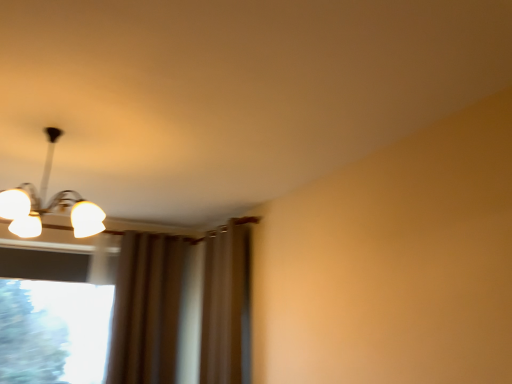
Question: From a real-world perspective, is transparent glass window at lower left physically above brown fabric curtain at center?

Choices:
 (A) no
 (B) yes

Answer: (A)

Question: Is transparent glass window at lower left oriented away from brown fabric curtain at center?

Choices:
 (A) yes
 (B) no

Answer: (B)

Question: Is the depth of transparent glass window at lower left greater than that of brown fabric curtain at center?

Choices:
 (A) no
 (B) yes

Answer: (B)

Question: Considering the relative sizes of transparent glass window at lower left and brown fabric curtain at center in the image provided, is transparent glass window at lower left taller than brown fabric curtain at center?

Choices:
 (A) no
 (B) yes

Answer: (A)

Question: Does transparent glass window at lower left have a lesser height compared to brown fabric curtain at center?

Choices:
 (A) no
 (B) yes

Answer: (B)

Question: Is transparent glass window at lower left wider or thinner than white glossy light fixture at upper left?

Choices:
 (A) thin
 (B) wide

Answer: (A)

Question: Considering the positions of transparent glass window at lower left and white glossy light fixture at upper left in the image, is transparent glass window at lower left taller or shorter than white glossy light fixture at upper left?

Choices:
 (A) short
 (B) tall

Answer: (B)

Question: Choose the correct answer: Is transparent glass window at lower left inside white glossy light fixture at upper left or outside it?

Choices:
 (A) outside
 (B) inside

Answer: (A)

Question: Looking at the image, does transparent glass window at lower left seem bigger or smaller compared to white glossy light fixture at upper left?

Choices:
 (A) small
 (B) big

Answer: (B)

Question: Considering the positions of brown fabric curtain at center and transparent glass window at lower left in the image, is brown fabric curtain at center bigger or smaller than transparent glass window at lower left?

Choices:
 (A) big
 (B) small

Answer: (A)

Question: Does point (237, 321) appear closer or farther from the camera than point (26, 253)?

Choices:
 (A) closer
 (B) farther

Answer: (A)

Question: From a real-world perspective, is brown fabric curtain at center above or below transparent glass window at lower left?

Choices:
 (A) below
 (B) above

Answer: (B)

Question: Which is correct: brown fabric curtain at center is inside transparent glass window at lower left, or outside of it?

Choices:
 (A) inside
 (B) outside

Answer: (B)

Question: In terms of width, does white glossy light fixture at upper left look wider or thinner when compared to transparent glass window at lower left?

Choices:
 (A) thin
 (B) wide

Answer: (B)

Question: Is white glossy light fixture at upper left spatially inside transparent glass window at lower left, or outside of it?

Choices:
 (A) inside
 (B) outside

Answer: (B)